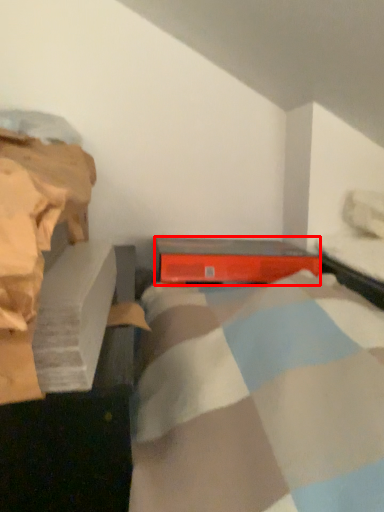
Question: From the image's perspective, what is the correct spatial relationship of equipment (annotated by the red box) in relation to bed frame?

Choices:
 (A) above
 (B) below

Answer: (B)